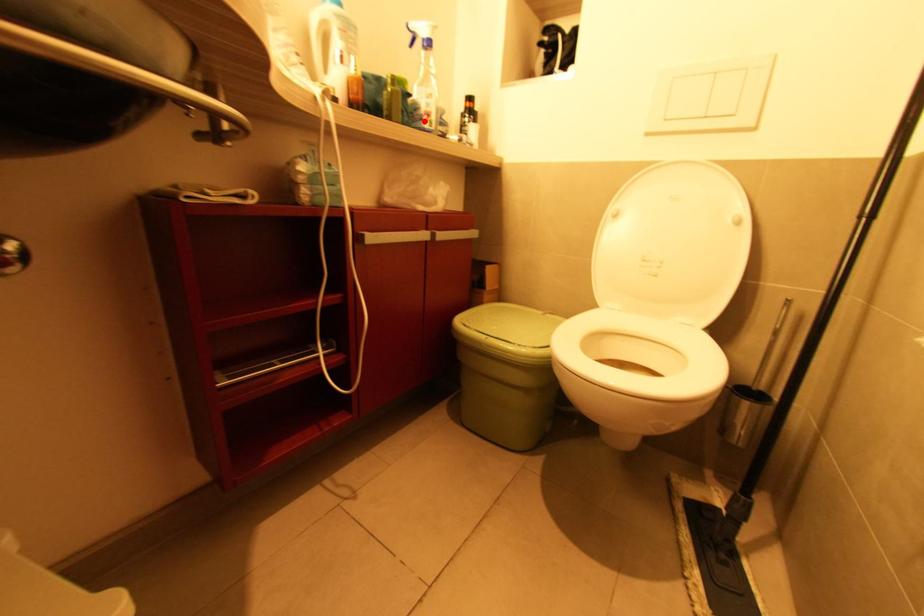
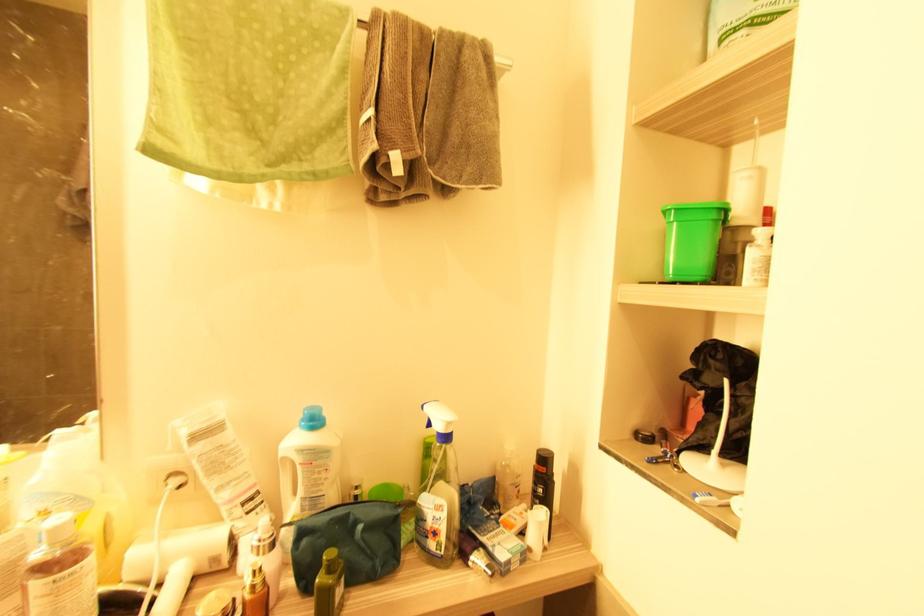
Question: I am providing you with two images of the same scene from different viewpoints. A red point is shown in image1. For the corresponding object point in image2, is it positioned nearer or farther from the camera?

Choices:
 (A) Nearer
 (B) Farther

Answer: (B)